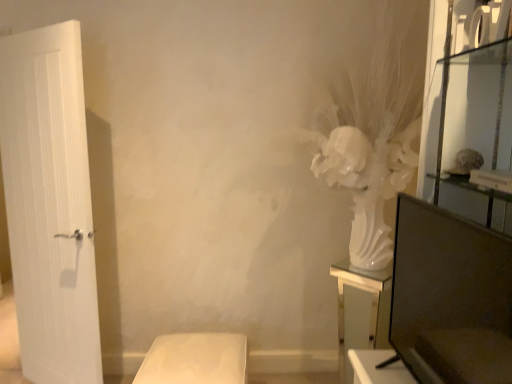
Question: From a real-world perspective, does white matte stool at lower center, the second furniture positioned from the right, stand above white glossy vase at right, which is counted as the 2th furniture, starting from the left?

Choices:
 (A) no
 (B) yes

Answer: (A)

Question: Can you confirm if white matte stool at lower center, the 1th furniture in the left-to-right sequence, is smaller than white glossy vase at right, which is counted as the 2th furniture, starting from the left?

Choices:
 (A) no
 (B) yes

Answer: (A)

Question: Is white matte stool at lower center, the second furniture positioned from the right, beside white glossy vase at right, which is counted as the 2th furniture, starting from the left?

Choices:
 (A) yes
 (B) no

Answer: (B)

Question: Does white matte stool at lower center, the 1th furniture in the left-to-right sequence, have a lesser height compared to white glossy vase at right, the first furniture in the right-to-left sequence?

Choices:
 (A) no
 (B) yes

Answer: (B)

Question: From a real-world perspective, is white matte stool at lower center, the second furniture positioned from the right, positioned under white glossy vase at right, which is counted as the 2th furniture, starting from the left, based on gravity?

Choices:
 (A) no
 (B) yes

Answer: (B)

Question: Is white matte stool at lower center, the 1th furniture in the left-to-right sequence, aimed at white glossy vase at right, the first furniture in the right-to-left sequence?

Choices:
 (A) no
 (B) yes

Answer: (A)

Question: Can you confirm if white glossy vase at right, the first furniture in the right-to-left sequence, is wider than white matte stool at lower center, the second furniture positioned from the right?

Choices:
 (A) yes
 (B) no

Answer: (B)

Question: Can you confirm if white glossy vase at right, which is counted as the 2th furniture, starting from the left, is shorter than white matte stool at lower center, the 1th furniture in the left-to-right sequence?

Choices:
 (A) no
 (B) yes

Answer: (A)

Question: Considering the relative sizes of white glossy vase at right, which is counted as the 2th furniture, starting from the left, and white matte stool at lower center, the second furniture positioned from the right, in the image provided, is white glossy vase at right, which is counted as the 2th furniture, starting from the left, smaller than white matte stool at lower center, the second furniture positioned from the right,?

Choices:
 (A) no
 (B) yes

Answer: (B)

Question: Considering the relative positions of white glossy vase at right, which is counted as the 2th furniture, starting from the left, and white matte stool at lower center, the 1th furniture in the left-to-right sequence, in the image provided, is white glossy vase at right, which is counted as the 2th furniture, starting from the left, in front of white matte stool at lower center, the 1th furniture in the left-to-right sequence,?

Choices:
 (A) yes
 (B) no

Answer: (B)

Question: Is white glossy vase at right, the first furniture in the right-to-left sequence, taller than white matte stool at lower center, the second furniture positioned from the right?

Choices:
 (A) yes
 (B) no

Answer: (A)

Question: Is white glossy vase at right, which is counted as the 2th furniture, starting from the left, thinner than white matte stool at lower center, the second furniture positioned from the right?

Choices:
 (A) no
 (B) yes

Answer: (B)

Question: Considering the positions of white matte stool at lower center, the second furniture positioned from the right, and white glossy vase at right, which is counted as the 2th furniture, starting from the left, in the image, is white matte stool at lower center, the second furniture positioned from the right, wider or thinner than white glossy vase at right, which is counted as the 2th furniture, starting from the left,?

Choices:
 (A) thin
 (B) wide

Answer: (B)